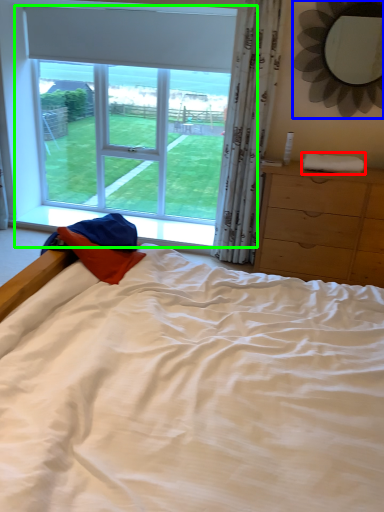
Question: Based on their relative distances, which object is farther from cloth (highlighted by a red box)? Choose from mirror (highlighted by a blue box) and window (highlighted by a green box).

Choices:
 (A) mirror
 (B) window

Answer: (B)